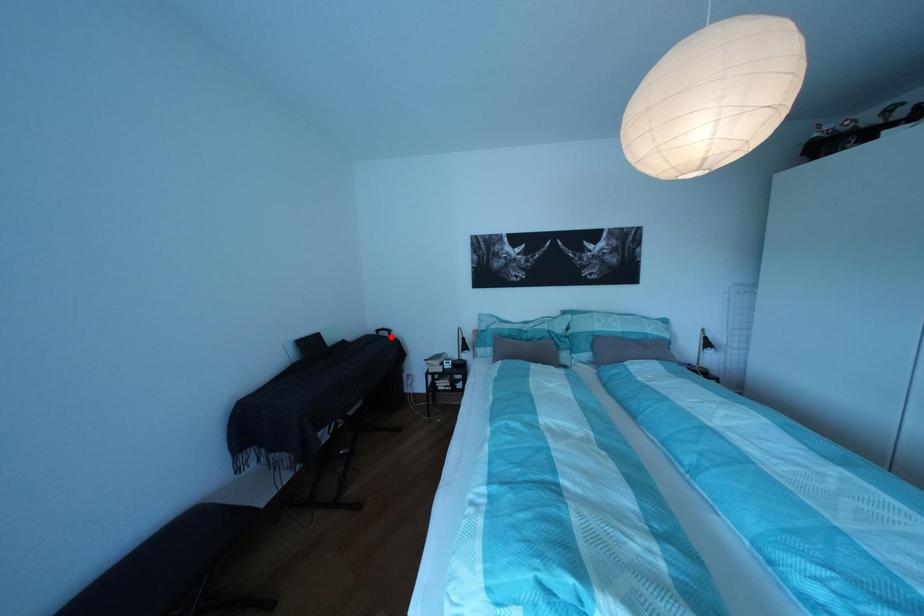
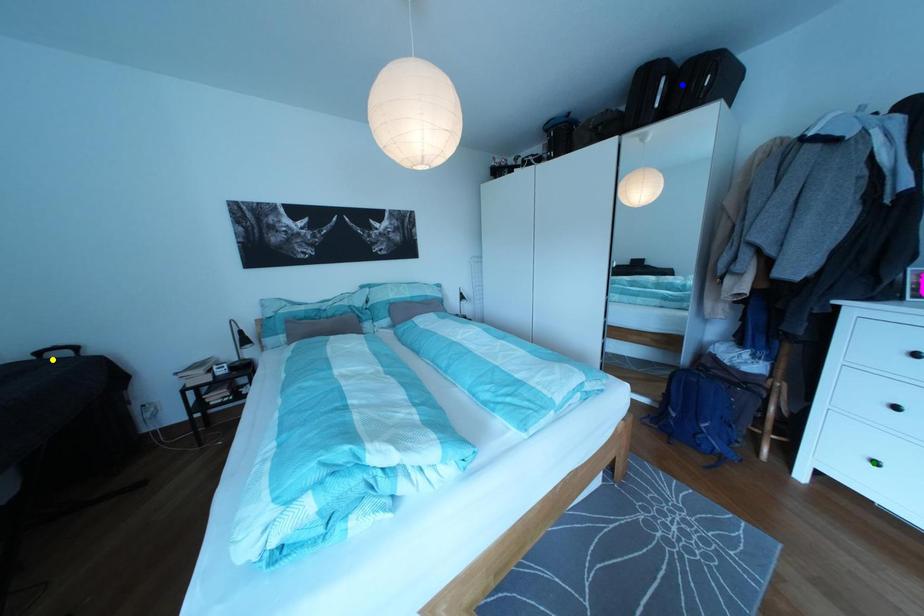
Question: I am providing you with two images of the same scene from different viewpoints. A red point is marked on the first image. You are given multiple points on the second image. Which point in image 2 is actually the same real-world point as the red point in image 1?

Choices:
 (A) yellow point
 (B) green point
 (C) blue point

Answer: (A)